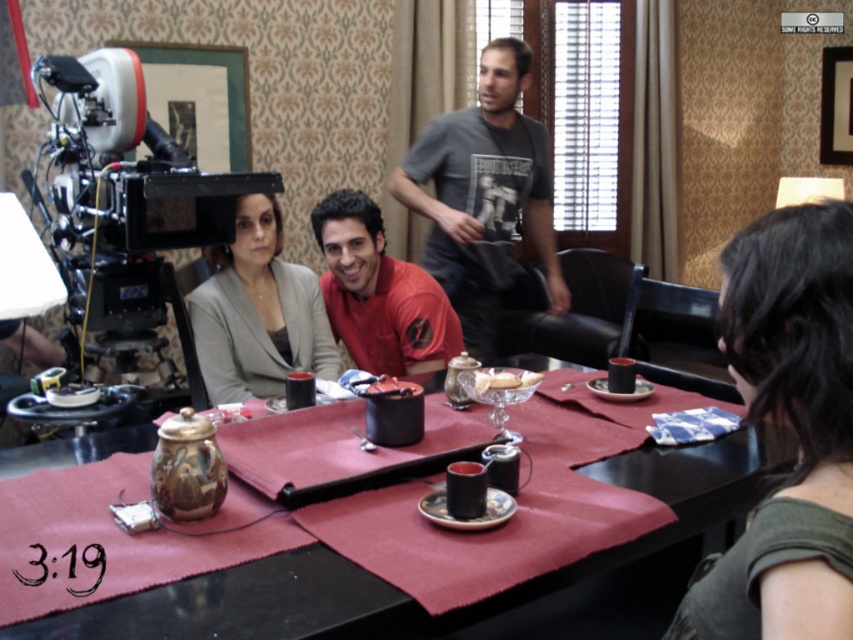
You are a photographer setting up for a photoshoot. You need to ensure that the green fabric shirt at right and the maroon fabric table at center are within a 20 inch frame. Can you fit both within the frame?

The green fabric shirt at right is 18.64 inches away from the maroon fabric table at center. Since the distance between them is less than 20 inches, both can be captured within the frame.

You are an actor who just finished a scene and needs to retrieve your water bottle. The water bottle is placed on the table covered by a red tablecloth. However, there is a metallic black video camera at left in the way. Can you reach the water bottle without moving the camera?

The metallic black video camera at left is located at point [125,200], so you can reach the water bottle on the table without moving the camera as it is positioned to the side.